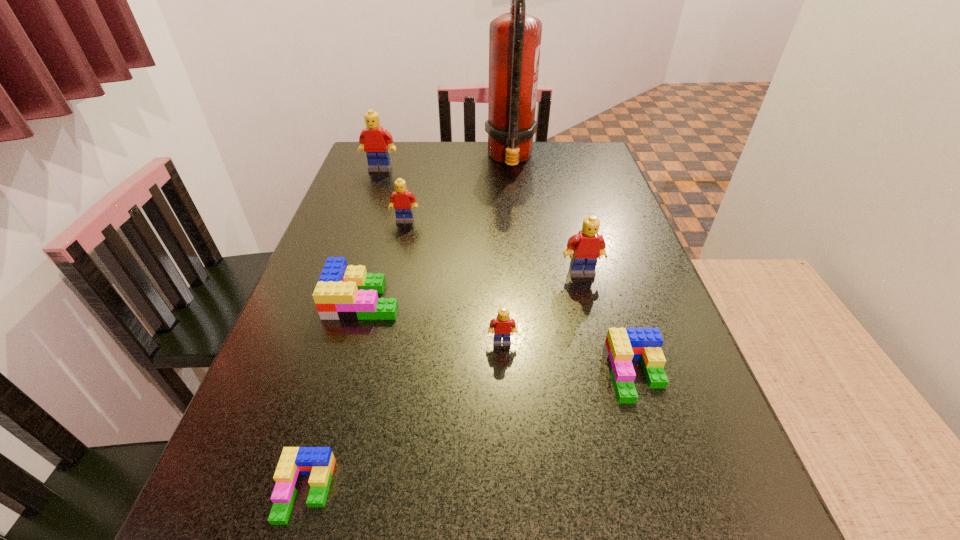
The image size is (960, 540). What are the coordinates of `free space located 0.190m on the front-facing side of the fifth nearest Lego` in the screenshot? It's located at (600, 345).

Where is `free space located on the front-facing side of the third tallest Lego`? This screenshot has height=540, width=960. free space located on the front-facing side of the third tallest Lego is located at coordinates (395, 267).

The image size is (960, 540). Find the location of `vacant point located on the front-facing side of the fifth tallest object`. vacant point located on the front-facing side of the fifth tallest object is located at coordinates (511, 532).

Where is `vacant space located 0.370m on the front of the fourth nearest object`? Image resolution: width=960 pixels, height=540 pixels. vacant space located 0.370m on the front of the fourth nearest object is located at coordinates (303, 518).

This screenshot has width=960, height=540. Find the location of `vacant space located on the front of the rightmost green Lego`. vacant space located on the front of the rightmost green Lego is located at coordinates (660, 449).

You are a GUI agent. You are given a task and a screenshot of the screen. Output one action in this format:
    pyautogui.click(x=<x>, y=<y>)
    Task: Click on the vacant space located on the back of the nearest object
    
    Given the screenshot: What is the action you would take?
    pyautogui.click(x=359, y=301)

You are a GUI agent. You are given a task and a screenshot of the screen. Output one action in this format:
    pyautogui.click(x=<x>, y=<y>)
    Task: Click on the fire extinguisher located in the far edge section of the desktop
    This screenshot has width=960, height=540.
    Given the screenshot: What is the action you would take?
    pyautogui.click(x=514, y=38)

You are a GUI agent. You are given a task and a screenshot of the screen. Output one action in this format:
    pyautogui.click(x=<x>, y=<y>)
    Task: Click on the Lego situated at the far edge
    The height and width of the screenshot is (540, 960).
    Given the screenshot: What is the action you would take?
    pyautogui.click(x=374, y=140)

Locate an element on the screen. The height and width of the screenshot is (540, 960). object that is at the far left corner is located at coordinates (374, 140).

You are a GUI agent. You are given a task and a screenshot of the screen. Output one action in this format:
    pyautogui.click(x=<x>, y=<y>)
    Task: Click on the free space at the far edge of the desktop
    
    Given the screenshot: What is the action you would take?
    point(553,167)